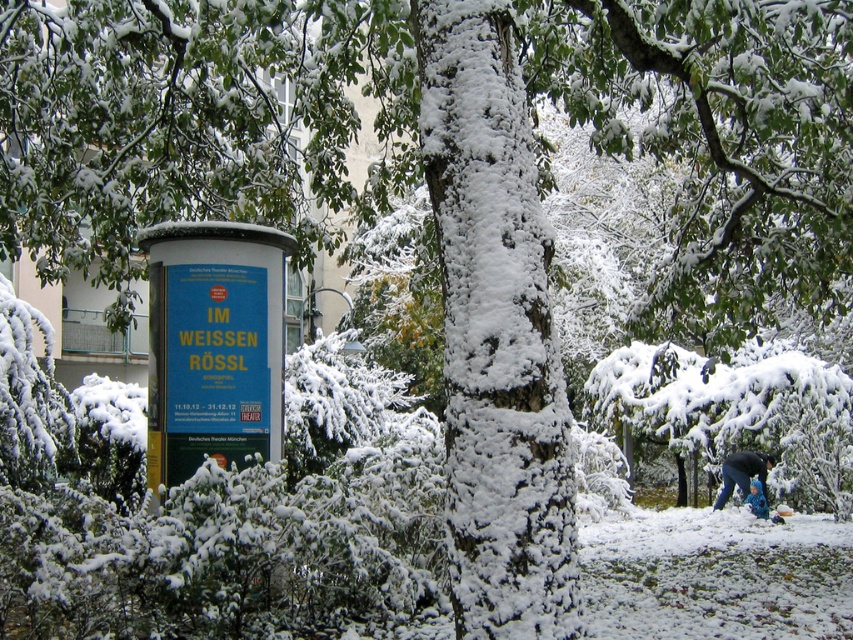
Between point (762, 477) and point (755, 513), which one is positioned behind?

Point (762, 477)

Which is in front, point (740, 460) or point (764, 515)?

Point (764, 515) is in front.

Locate an element on the screen. This screenshot has height=640, width=853. dark blue jacket at lower right is located at coordinates point(743,474).

Can you confirm if blue paper at center is smaller than blue fuzzy coat at lower right?

No.

Which is above, blue paper at center or blue fuzzy coat at lower right?

blue paper at center is above.

Find the location of a particular element. This screenshot has width=853, height=640. blue paper at center is located at coordinates (213, 344).

Is blue paper at center below dark blue jacket at lower right?

Actually, blue paper at center is above dark blue jacket at lower right.

Is the position of blue paper at center less distant than that of dark blue jacket at lower right?

Yes, it is.

Between point (175, 320) and point (720, 504), which one is positioned behind?

Positioned behind is point (720, 504).

This screenshot has width=853, height=640. What are the coordinates of `blue paper at center` in the screenshot? It's located at click(x=213, y=344).